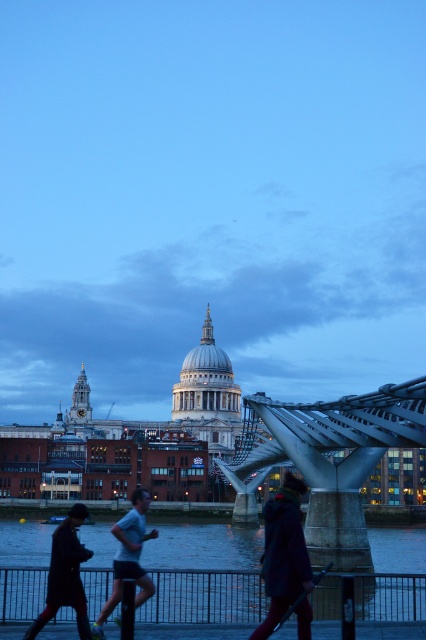
You are a tourist standing at the south bank of the River Thames and want to cross to the north bank. The polished steel suspension bridge at center is your only option. Is the bridge directly in front of you, to your left, or to your right?

The polished steel suspension bridge at center is located at coordinates (331,458), which places it directly in front of you.

You are a pedestrian standing on the polished steel suspension bridge at center and want to pick up the dark brown leather coat at lower left. Is the coat visible to you from your current position?

The dark brown leather coat at lower left is behind the polished steel suspension bridge at center, so it is not visible from your current position on the bridge.

You are a tourist standing on the Millennium Bridge and want to take a photo of the dark blue water at lower center and the velvet purple coat at lower right. Which object will appear wider in the photo?

The dark blue water at lower center will appear wider in the photo because its width is larger than the velvet purple coat at lower right.